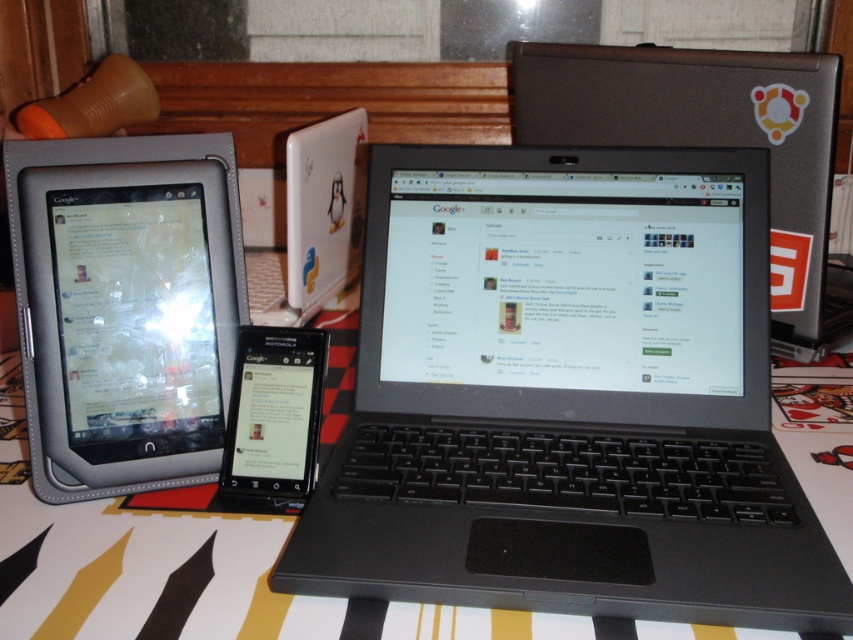
From the picture: Where is the black plastic laptop at center located in the image?

The black plastic laptop at center is located at point 0.620 on the x axis and 0.666 on the y axis.

You are standing in front of the workspace setup. There are two points marked on the table surface. The first point is at coordinates point (688, 300) and the second is at point (22, 360). If you want to place a small object between them, which point should you move towards first to ensure the object is closer to you?

The point at (688, 300) is closer to the viewer than the point at (22, 360). Therefore, you should move towards point (688, 300) first to place the object closer to you.